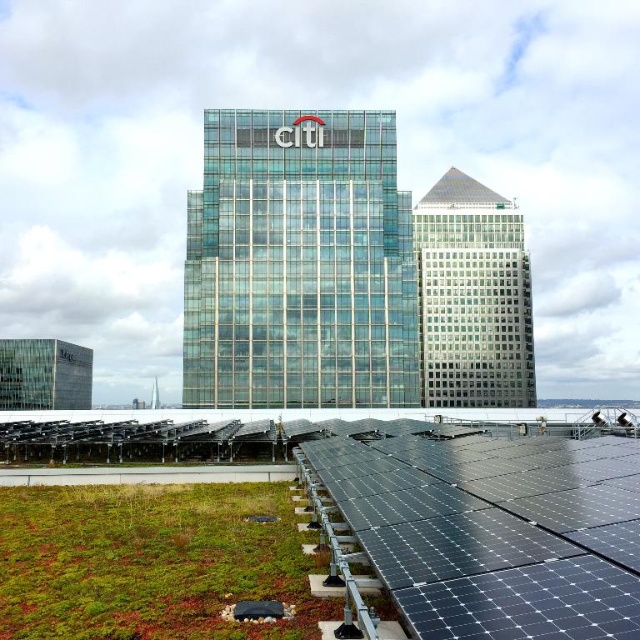
Question: Can you confirm if green mossy roof at lower left is wider than transparent glass pyramid at upper center?

Choices:
 (A) no
 (B) yes

Answer: (A)

Question: Which point is closer to the camera?

Choices:
 (A) (486, 193)
 (B) (12, 536)

Answer: (B)

Question: Observing the image, what is the correct spatial positioning of green mossy roof at lower left in reference to transparent glass pyramid at upper center?

Choices:
 (A) above
 (B) below

Answer: (B)

Question: Is green mossy roof at lower left wider than transparent glass pyramid at upper center?

Choices:
 (A) yes
 (B) no

Answer: (B)

Question: Which of the following is the closest to the observer?

Choices:
 (A) (104, 636)
 (B) (429, 189)

Answer: (A)